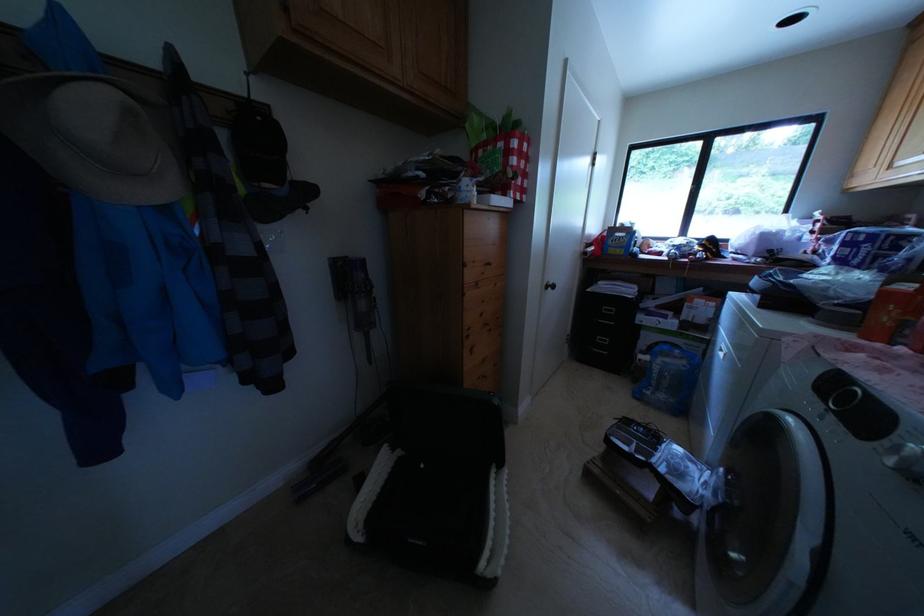
I want to click on filing cabinet handle, so click(x=550, y=288).